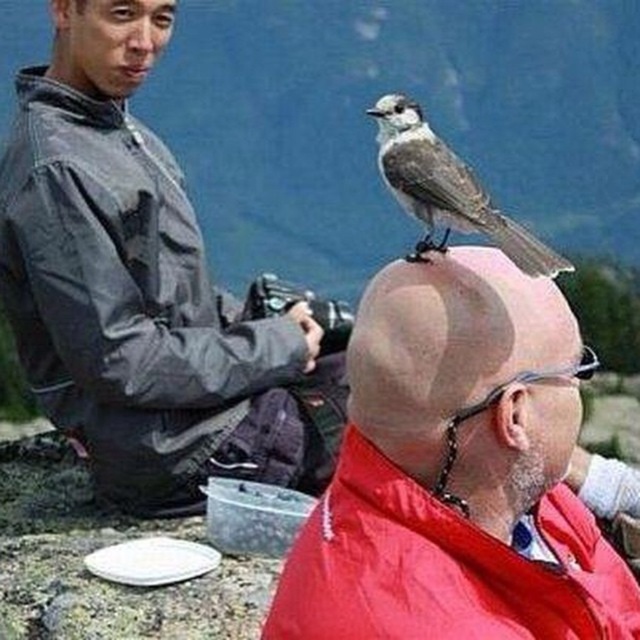
Question: Can you confirm if bald scalp at center is wider than gray matte bird at upper center?

Choices:
 (A) yes
 (B) no

Answer: (A)

Question: Which of these objects is positioned closest to the bald head at center?

Choices:
 (A) matte gray jacket at left
 (B) smooth skin head at upper left
 (C) bald scalp at center
 (D) gray matte bird at upper center

Answer: (C)

Question: Which object appears farthest from the camera in this image?

Choices:
 (A) matte gray jacket at left
 (B) bald head at center
 (C) gray matte bird at upper center
 (D) smooth skin head at upper left

Answer: (D)

Question: Can you confirm if bald head at center is positioned below matte gray jacket at left?

Choices:
 (A) no
 (B) yes

Answer: (B)

Question: Which object is the farthest from the matte gray jacket at left?

Choices:
 (A) gray matte bird at upper center
 (B) smooth skin head at upper left
 (C) bald head at center

Answer: (C)

Question: Can you confirm if bald scalp at center is smaller than smooth skin head at upper left?

Choices:
 (A) yes
 (B) no

Answer: (B)